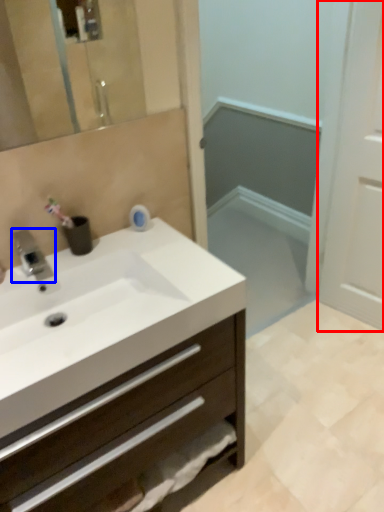
Question: Which object appears closest to the camera in this image, screen door (highlighted by a red box) or tap (highlighted by a blue box)?

Choices:
 (A) screen door
 (B) tap

Answer: (B)